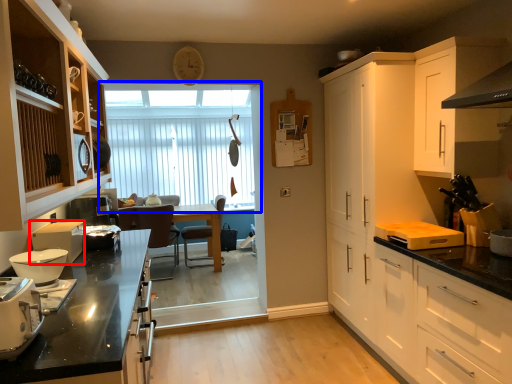
Question: Which of the following is the farthest to the observer, kitchen appliance (highlighted by a red box) or window (highlighted by a blue box)?

Choices:
 (A) kitchen appliance
 (B) window

Answer: (B)